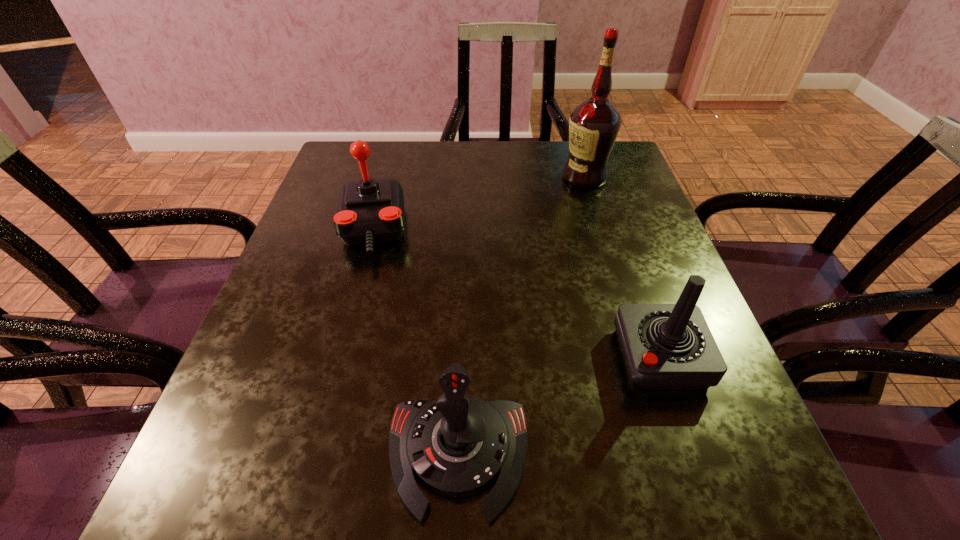
Identify the location of alcohol. The height and width of the screenshot is (540, 960). (594, 125).

The width and height of the screenshot is (960, 540). What are the coordinates of `the tallest object` in the screenshot? It's located at (594, 125).

You are a GUI agent. You are given a task and a screenshot of the screen. Output one action in this format:
    pyautogui.click(x=<x>, y=<y>)
    Task: Click on the farthest joystick
    This screenshot has width=960, height=540.
    Given the screenshot: What is the action you would take?
    pyautogui.click(x=370, y=211)

The width and height of the screenshot is (960, 540). Find the location of `the third nearest object`. the third nearest object is located at coordinates (370, 211).

Where is `the rightmost joystick`? This screenshot has height=540, width=960. the rightmost joystick is located at coordinates (665, 346).

Locate an element on the screen. The width and height of the screenshot is (960, 540). the third farthest object is located at coordinates (665, 346).

Locate an element on the screen. The width and height of the screenshot is (960, 540). the shortest joystick is located at coordinates (458, 445).

You are a GUI agent. You are given a task and a screenshot of the screen. Output one action in this format:
    pyautogui.click(x=<x>, y=<y>)
    Task: Click on the nearest object
    Image resolution: width=960 pixels, height=540 pixels.
    Given the screenshot: What is the action you would take?
    pyautogui.click(x=458, y=445)

What are the coordinates of `vacant position located on the label of the tallest object` in the screenshot? It's located at (532, 177).

Locate an element on the screen. The image size is (960, 540). vacant area situated 0.340m on the label of the tallest object is located at coordinates (433, 177).